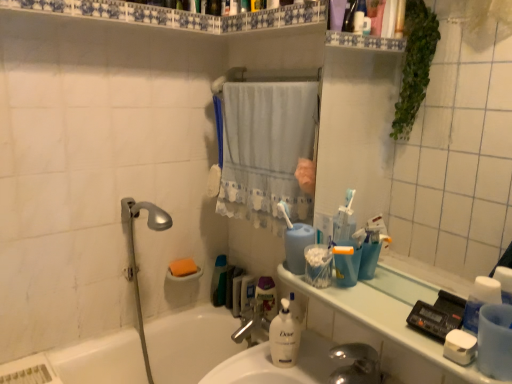
Where is `free location to the right of white matte bottle at center, placed as the second cleaning product when sorted from top to bottom`? Image resolution: width=512 pixels, height=384 pixels. free location to the right of white matte bottle at center, placed as the second cleaning product when sorted from top to bottom is located at coordinates (314, 365).